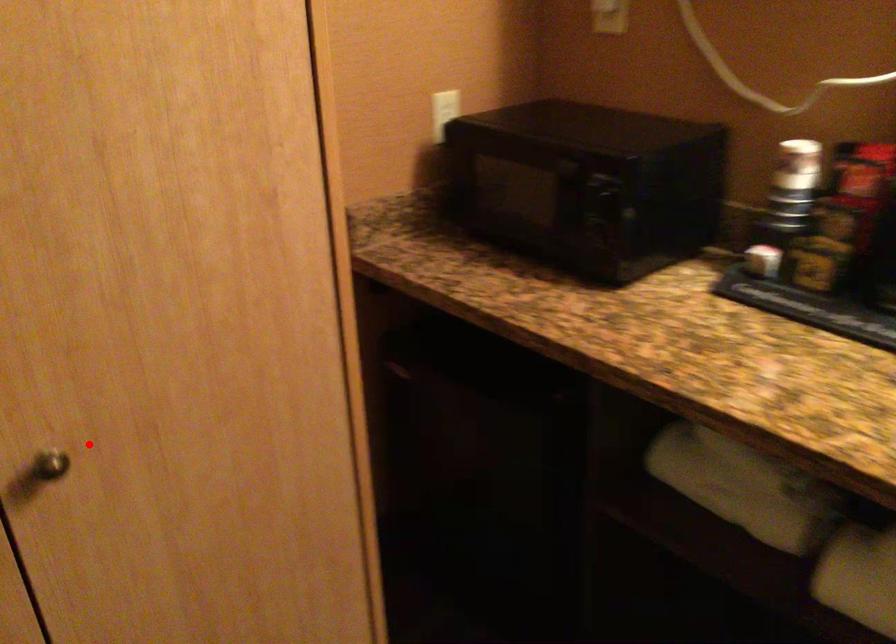
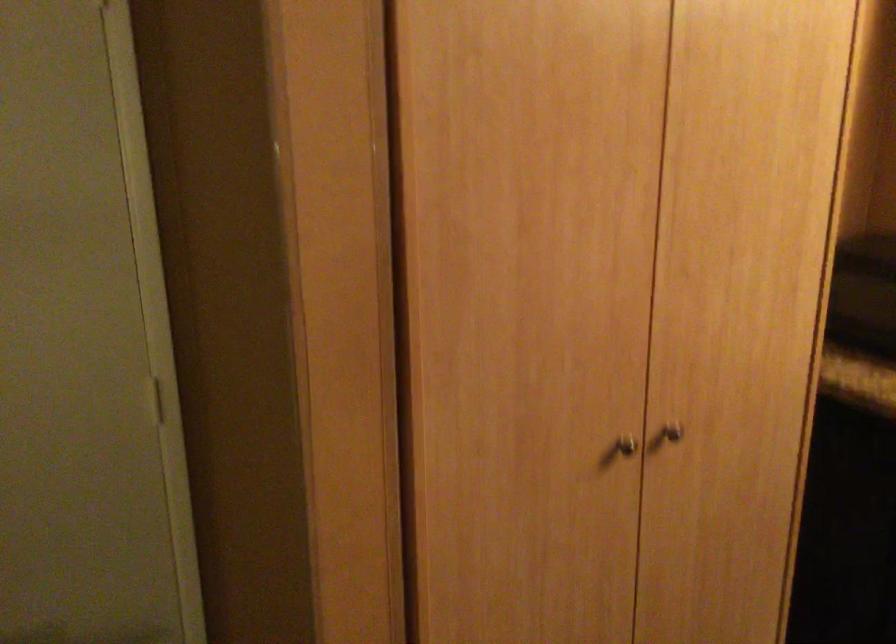
Locate, in the second image, the point that corresponds to the highlighted location in the first image.

(673, 431)